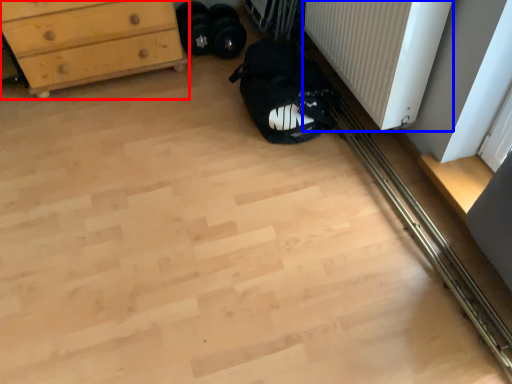
Question: Which object appears farthest to the camera in this image, chest of drawers (highlighted by a red box) or radiator (highlighted by a blue box)?

Choices:
 (A) chest of drawers
 (B) radiator

Answer: (A)